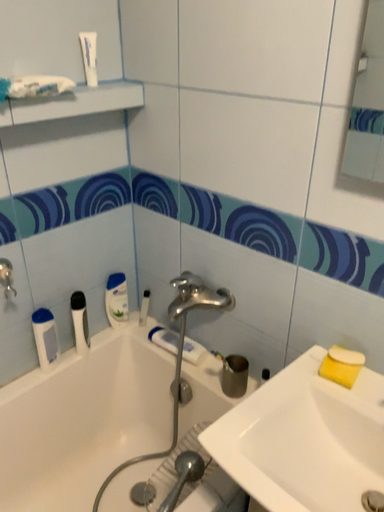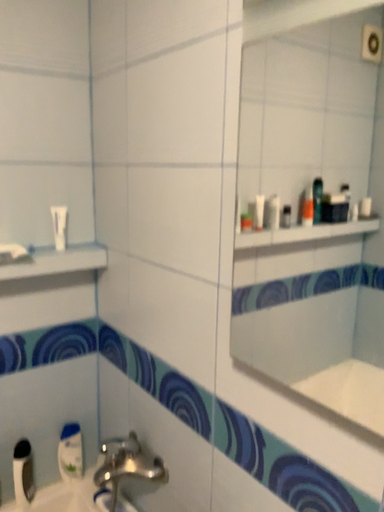
Question: Which way did the camera rotate in the video?

Choices:
 (A) rotated left
 (B) rotated right

Answer: (A)